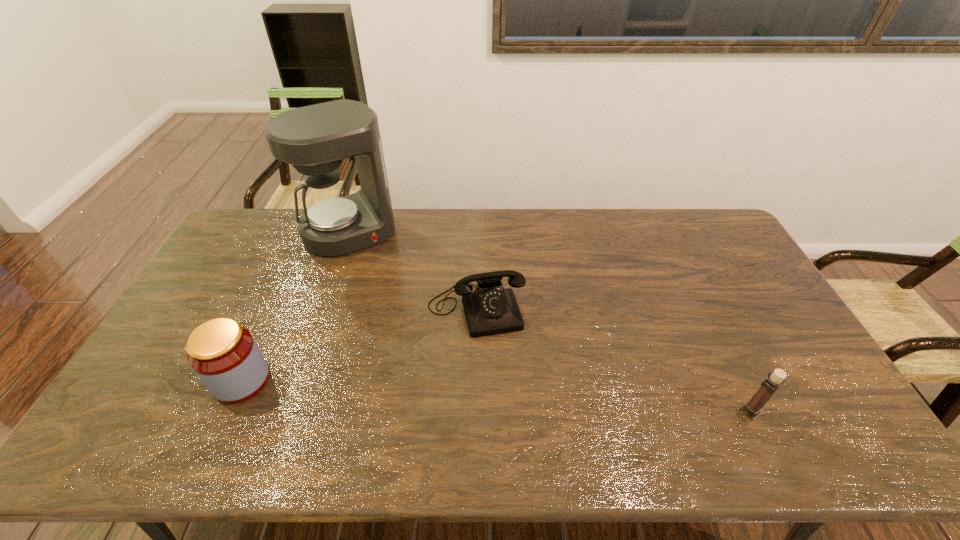
This screenshot has height=540, width=960. In order to click on vacant area situated 0.050m on the front face of the third object from left to right in this screenshot , I will do `click(490, 351)`.

At what (x,y) coordinates should I click in order to perform the action: click on free region located 0.070m on the button side of the coffee maker. Please return your answer as a coordinate pair (x, y). Looking at the image, I should click on (x=372, y=267).

The height and width of the screenshot is (540, 960). I want to click on free space located 0.250m on the button side of the coffee maker, so click(392, 301).

The height and width of the screenshot is (540, 960). What are the coordinates of `vacant area situated 0.280m on the button side of the coffee maker` in the screenshot? It's located at (395, 307).

Image resolution: width=960 pixels, height=540 pixels. I want to click on object at the far edge, so click(314, 139).

Locate an element on the screen. jar that is at the near edge is located at coordinates (224, 355).

The width and height of the screenshot is (960, 540). Find the location of `candle holder at the near edge`. candle holder at the near edge is located at coordinates (776, 379).

In the image, there is a desktop. Where is `vacant space at the far edge`? vacant space at the far edge is located at coordinates (432, 232).

Identify the location of vacant area at the near edge. The image size is (960, 540). (678, 393).

Where is `vacant area at the left edge`? vacant area at the left edge is located at coordinates (259, 256).